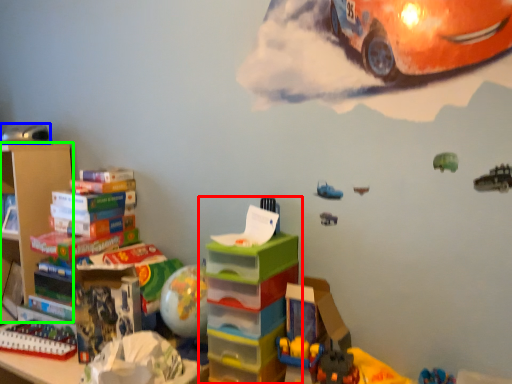
Question: Which is farther away from toy (highlighted by a red box)? toy (highlighted by a blue box) or shelf (highlighted by a green box)?

Choices:
 (A) toy
 (B) shelf

Answer: (A)